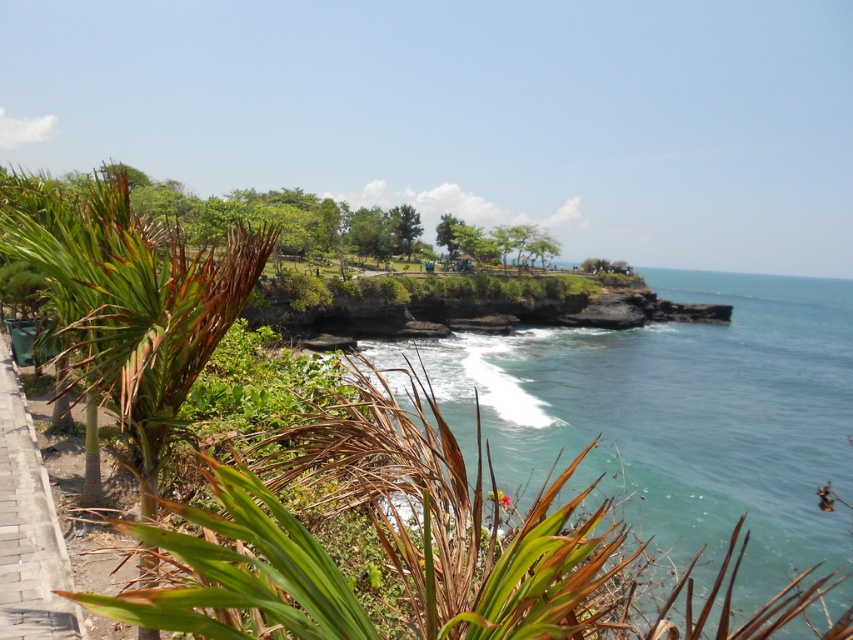
Question: Is clear blue water at center closer to the viewer compared to brick paved path at lower left?

Choices:
 (A) yes
 (B) no

Answer: (B)

Question: Is green leafy palm tree at left to the right of brick paved path at lower left from the viewer's perspective?

Choices:
 (A) no
 (B) yes

Answer: (A)

Question: Does clear blue water at center come behind green leafy palm tree at left?

Choices:
 (A) yes
 (B) no

Answer: (A)

Question: Among these points, which one is farthest from the camera?

Choices:
 (A) (705, 513)
 (B) (108, 314)

Answer: (A)

Question: Which point is closer to the camera taking this photo?

Choices:
 (A) (727, 464)
 (B) (16, 400)
 (C) (16, 204)

Answer: (B)

Question: Which point appears closest to the camera in this image?

Choices:
 (A) (50, 497)
 (B) (215, 337)
 (C) (703, 376)

Answer: (B)